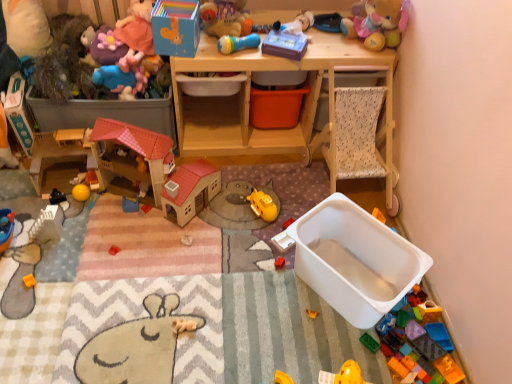
Image resolution: width=512 pixels, height=384 pixels. Identify the location of free spot in front of translucent plastic car at lower right, placed as the 1th toy when sorted from right to left. (423, 363).